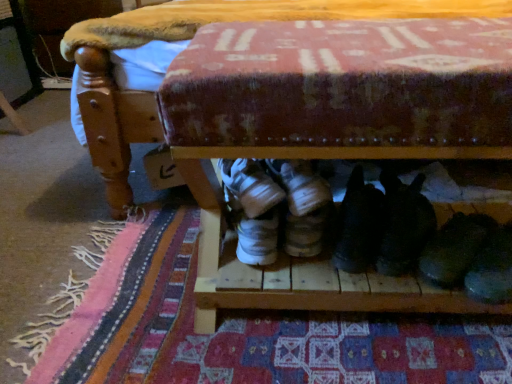
What do you see at coordinates (404, 225) in the screenshot? I see `black suede shoes at lower right, the second footwear in the right-to-left sequence` at bounding box center [404, 225].

Describe the element at coordinates (358, 224) in the screenshot. The height and width of the screenshot is (384, 512). I see `black suede shoes at center, the second footwear when ordered from left to right` at that location.

Image resolution: width=512 pixels, height=384 pixels. What do you see at coordinates (454, 249) in the screenshot? I see `shiny black shoe at lower right, acting as the 4th footwear starting from the left` at bounding box center [454, 249].

Where is `white suede sneakers at center, marked as the fourth footwear in a right-to-left arrangement`? Image resolution: width=512 pixels, height=384 pixels. white suede sneakers at center, marked as the fourth footwear in a right-to-left arrangement is located at coordinates (258, 239).

From a real-world perspective, count 1st footwears downward from the white suede sneakers at center, the 1th footwear from the left, and point to it. Please provide its 2D coordinates.

[(404, 225)]

Is white suede sneakers at center, the 1th footwear from the left, oriented away from black suede shoes at lower right, the third footwear in the left-to-right sequence?

No.

How distant is white suede sneakers at center, the 1th footwear from the left, from black suede shoes at lower right, the second footwear in the right-to-left sequence?

white suede sneakers at center, the 1th footwear from the left, is 10.58 inches away from black suede shoes at lower right, the second footwear in the right-to-left sequence.

Who is bigger, white suede sneakers at center, the 1th footwear from the left, or black suede shoes at lower right, the second footwear in the right-to-left sequence?

Bigger between the two is white suede sneakers at center, the 1th footwear from the left.

Is black suede shoes at lower right, the second footwear in the right-to-left sequence, positioned beyond the bounds of wooden bench at lower center?

Yes, black suede shoes at lower right, the second footwear in the right-to-left sequence, is not within wooden bench at lower center.

Identify the location of furniture behind the black suede shoes at lower right, the second footwear in the right-to-left sequence. (180, 51).

Which of these two, black suede shoes at lower right, the third footwear in the left-to-right sequence, or wooden bench at lower center, is bigger?

Bigger between the two is wooden bench at lower center.

Does point (451, 219) come behind point (431, 341)?

Yes, it is.

Are shiny black shoe at lower right, which is counted as the 1th footwear, starting from the right, and patterned fabric mat at lower center far apart?

Actually, shiny black shoe at lower right, which is counted as the 1th footwear, starting from the right, and patterned fabric mat at lower center are a little close together.

What's the angular difference between shiny black shoe at lower right, which is counted as the 1th footwear, starting from the right, and patterned fabric mat at lower center's facing directions?

There is a 24.2-degree angle between the facing directions of shiny black shoe at lower right, which is counted as the 1th footwear, starting from the right, and patterned fabric mat at lower center.

Considering the relative positions of shiny black shoe at lower right, acting as the 4th footwear starting from the left, and patterned fabric mat at lower center in the image provided, is shiny black shoe at lower right, acting as the 4th footwear starting from the left, to the left or to the right of patterned fabric mat at lower center?

Based on their positions, shiny black shoe at lower right, acting as the 4th footwear starting from the left, is located to the right of patterned fabric mat at lower center.

Who is shorter, patterned fabric mat at lower center or wooden bench at lower center?

Standing shorter between the two is patterned fabric mat at lower center.

Between patterned fabric mat at lower center and wooden bench at lower center, which one has smaller width?

Thinner between the two is patterned fabric mat at lower center.

From a real-world perspective, between patterned fabric mat at lower center and wooden bench at lower center, who is vertically higher?

In real-world perspective, wooden bench at lower center is above.

Is patterned fabric mat at lower center spatially inside wooden bench at lower center, or outside of it?

patterned fabric mat at lower center exists outside the volume of wooden bench at lower center.

What's the angular difference between wooden bench at lower center and white suede sneakers at center, the 1th footwear from the left,'s facing directions?

The angular difference between wooden bench at lower center and white suede sneakers at center, the 1th footwear from the left, is 3.69 degrees.

Is wooden bench at lower center wider or thinner than white suede sneakers at center, marked as the fourth footwear in a right-to-left arrangement?

Clearly, wooden bench at lower center has more width compared to white suede sneakers at center, marked as the fourth footwear in a right-to-left arrangement.

Is wooden bench at lower center next to white suede sneakers at center, the 1th footwear from the left, and touching it?

They are not placed beside each other.

Is wooden bench at lower center aimed at white suede sneakers at center, marked as the fourth footwear in a right-to-left arrangement?

Yes, wooden bench at lower center is turned towards white suede sneakers at center, marked as the fourth footwear in a right-to-left arrangement.

Is black suede shoes at lower right, the second footwear in the right-to-left sequence, situated inside patterned fabric mat at lower center or outside?

black suede shoes at lower right, the second footwear in the right-to-left sequence, exists outside the volume of patterned fabric mat at lower center.

Is black suede shoes at lower right, the third footwear in the left-to-right sequence, in front of patterned fabric mat at lower center?

No.

Which point is more forward, (431, 213) or (97, 270)?

The point (431, 213) is more forward.

Which of these two, black suede shoes at lower right, the third footwear in the left-to-right sequence, or patterned fabric mat at lower center, is wider?

Wider between the two is patterned fabric mat at lower center.

Does patterned fabric mat at lower center appear on the right side of black suede shoes at lower right, the third footwear in the left-to-right sequence?

Incorrect, patterned fabric mat at lower center is not on the right side of black suede shoes at lower right, the third footwear in the left-to-right sequence.

You are a GUI agent. You are given a task and a screenshot of the screen. Output one action in this format:
    pyautogui.click(x=<x>, y=<y>)
    Task: Click on the footwear that is the 3rd one when counting backward from the patterned fabric mat at lower center
    This screenshot has width=512, height=384.
    Given the screenshot: What is the action you would take?
    pyautogui.click(x=404, y=225)

Considering the positions of points (148, 326) and (410, 246), is point (148, 326) closer to camera compared to point (410, 246)?

No.

Measure the distance from patterned fabric mat at lower center to black suede shoes at lower right, the third footwear in the left-to-right sequence.

patterned fabric mat at lower center is 12.06 inches from black suede shoes at lower right, the third footwear in the left-to-right sequence.

Locate an element on the screen. This screenshot has height=384, width=512. the 2nd footwear to the right when counting from the white suede sneakers at center, the 1th footwear from the left is located at coordinates (404, 225).

Identify the location of furniture located above the black suede shoes at lower right, the second footwear in the right-to-left sequence (from a real-world perspective). (180, 51).

Estimate the real-world distances between objects in this image. Which object is further from black suede shoes at center, the second footwear when ordered from left to right, white suede sneakers at center, the 1th footwear from the left, or patterned fabric mat at lower center?

The object further to black suede shoes at center, the second footwear when ordered from left to right, is patterned fabric mat at lower center.

Looking at the image, which one is located closer to wooden bench at lower center, patterned fabric mat at lower center or shiny black shoe at lower right, acting as the 4th footwear starting from the left?

patterned fabric mat at lower center is closer to wooden bench at lower center.

Which object lies nearer to the anchor point shiny black shoe at lower right, acting as the 4th footwear starting from the left, white suede sneakers at center, marked as the fourth footwear in a right-to-left arrangement, or wooden bench at lower center?

white suede sneakers at center, marked as the fourth footwear in a right-to-left arrangement, lies closer to shiny black shoe at lower right, acting as the 4th footwear starting from the left, than the other object.

Looking at the image, which one is located further to patterned fabric mat at lower center, white suede sneakers at center, the 1th footwear from the left, or shiny black shoe at lower right, acting as the 4th footwear starting from the left?

shiny black shoe at lower right, acting as the 4th footwear starting from the left, lies further to patterned fabric mat at lower center than the other object.

From the picture: Which object lies further to the anchor point black suede shoes at lower right, the second footwear in the right-to-left sequence, black suede shoes at center, which is counted as the 3th footwear, starting from the right, or white suede sneakers at center, the 1th footwear from the left?

white suede sneakers at center, the 1th footwear from the left.

Looking at the image, which one is located closer to shiny black shoe at lower right, acting as the 4th footwear starting from the left, black suede shoes at center, which is counted as the 3th footwear, starting from the right, or white suede sneakers at center, the 1th footwear from the left?

black suede shoes at center, which is counted as the 3th footwear, starting from the right, is closer to shiny black shoe at lower right, acting as the 4th footwear starting from the left.

Considering their positions, is black suede shoes at center, which is counted as the 3th footwear, starting from the right, positioned further to white suede sneakers at center, the 1th footwear from the left, than wooden bench at lower center?

wooden bench at lower center is further to white suede sneakers at center, the 1th footwear from the left.

Estimate the real-world distances between objects in this image. Which object is closer to wooden bench at lower center, black suede shoes at center, the second footwear when ordered from left to right, or white suede sneakers at center, marked as the fourth footwear in a right-to-left arrangement?

The object closer to wooden bench at lower center is white suede sneakers at center, marked as the fourth footwear in a right-to-left arrangement.

I want to click on footwear between white suede sneakers at center, the 1th footwear from the left, and black suede shoes at lower right, the third footwear in the left-to-right sequence, in the horizontal direction, so click(x=358, y=224).

This screenshot has height=384, width=512. What are the coordinates of `mat between white suede sneakers at center, marked as the fourth footwear in a right-to-left arrangement, and black suede shoes at center, the second footwear when ordered from left to right, from left to right` in the screenshot? It's located at (248, 330).

Image resolution: width=512 pixels, height=384 pixels. Identify the location of footwear situated between patterned fabric mat at lower center and black suede shoes at lower right, the second footwear in the right-to-left sequence, from left to right. (358, 224).

Find the location of a particular element. mat between white suede sneakers at center, marked as the fourth footwear in a right-to-left arrangement, and black suede shoes at lower right, the third footwear in the left-to-right sequence, in the horizontal direction is located at coordinates point(248,330).